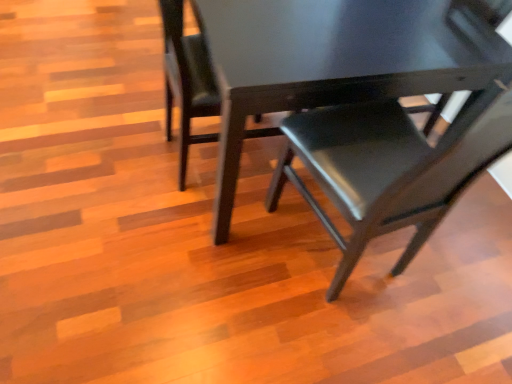
Question: From a real-world perspective, is matte black chair at center, the third chair viewed from the left, on top of matte black chair at center, the 3th chair in the right-to-left sequence?

Choices:
 (A) yes
 (B) no

Answer: (A)

Question: Does matte black chair at center, the third chair viewed from the left, lie behind matte black chair at center, the 3th chair in the right-to-left sequence?

Choices:
 (A) no
 (B) yes

Answer: (A)

Question: Is matte black chair at center, the third chair viewed from the left, not within matte black chair at center, the 3th chair in the right-to-left sequence?

Choices:
 (A) no
 (B) yes

Answer: (B)

Question: Is matte black chair at center, the third chair viewed from the left, at the left side of matte black chair at center, the 1th chair when ordered from left to right?

Choices:
 (A) no
 (B) yes

Answer: (A)

Question: Is matte black chair at center, the third chair viewed from the left, positioned in front of matte black chair at center, the 3th chair in the right-to-left sequence?

Choices:
 (A) no
 (B) yes

Answer: (B)

Question: Does matte black chair at center, the third chair viewed from the left, have a lesser width compared to matte black chair at center, the 1th chair when ordered from left to right?

Choices:
 (A) yes
 (B) no

Answer: (B)

Question: Does matte black chair at center, the 1th chair when ordered from left to right, lie in front of matte black chair at center, the third chair viewed from the left?

Choices:
 (A) no
 (B) yes

Answer: (A)

Question: From the image's perspective, does matte black chair at center, the 3th chair in the right-to-left sequence, appear higher than matte black chair at center, the third chair viewed from the left?

Choices:
 (A) no
 (B) yes

Answer: (B)

Question: Is matte black chair at center, the 3th chair in the right-to-left sequence, to the left of matte black chair at center, the third chair viewed from the left, from the viewer's perspective?

Choices:
 (A) no
 (B) yes

Answer: (B)

Question: Is matte black chair at center, the 1th chair when ordered from left to right, bigger than matte black chair at center, the third chair viewed from the left?

Choices:
 (A) yes
 (B) no

Answer: (B)

Question: Are matte black chair at center, the 3th chair in the right-to-left sequence, and matte black chair at center, arranged as the 1th chair when viewed from the right, making contact?

Choices:
 (A) no
 (B) yes

Answer: (A)

Question: Is matte black chair at center, the 1th chair when ordered from left to right, positioned behind matte black chair at center, arranged as the 1th chair when viewed from the right?

Choices:
 (A) yes
 (B) no

Answer: (A)

Question: Does matte black chair at center, which ranks as the 2th chair in left-to-right order, appear on the left side of matte black chair at center, arranged as the 1th chair when viewed from the right?

Choices:
 (A) no
 (B) yes

Answer: (B)